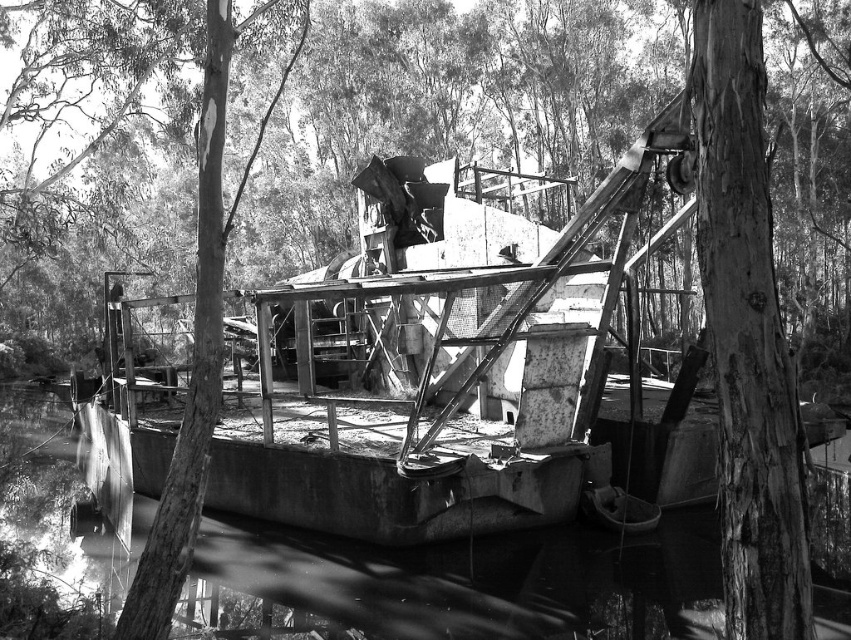
Between point (72, 324) and point (524, 576), which one is positioned in front?

Point (524, 576)

Based on the photo, how far apart are rough bark tree at center and smooth concrete river at center?

A distance of 17.62 meters exists between rough bark tree at center and smooth concrete river at center.

Where is `rough bark tree at center`? This screenshot has height=640, width=851. rough bark tree at center is located at coordinates (431, 104).